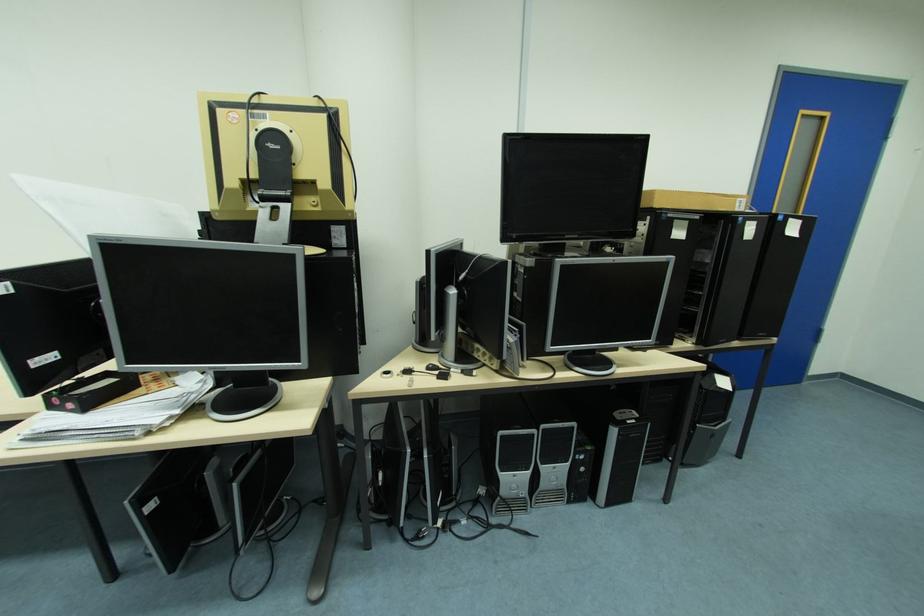
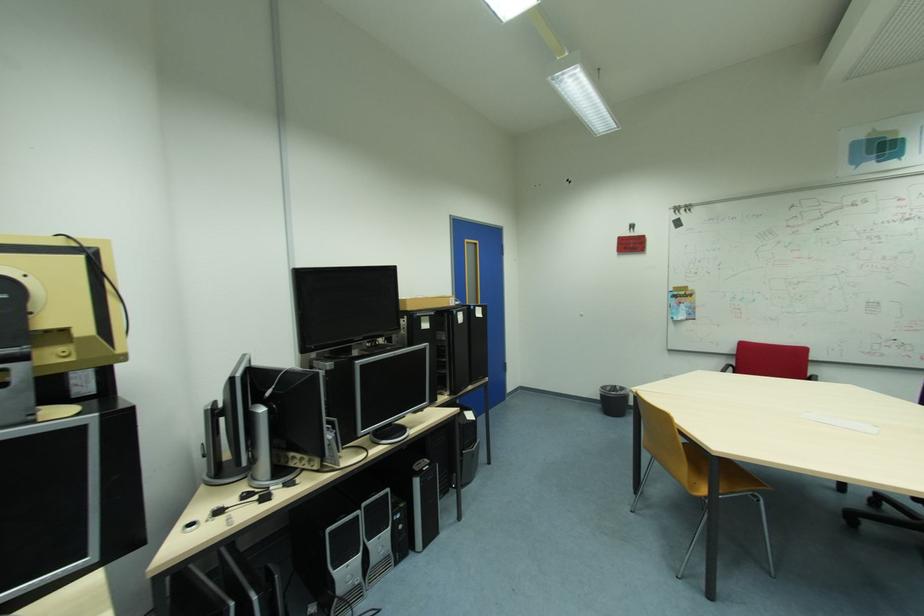
The point at (322, 103) is marked in the first image. Where is the corresponding point in the second image?

(66, 244)